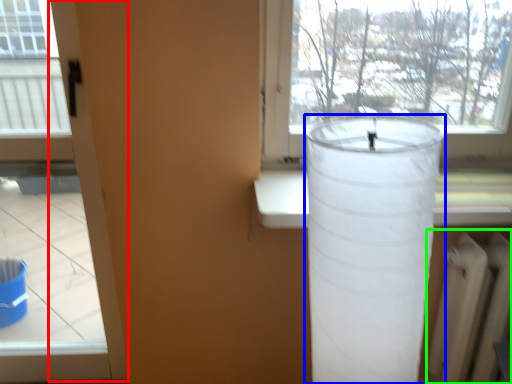
Question: Estimate the real-world distances between objects in this image. Which object is closer to screen door (highlighted by a red box), lamp (highlighted by a blue box) or radiator (highlighted by a green box)?

Choices:
 (A) lamp
 (B) radiator

Answer: (A)